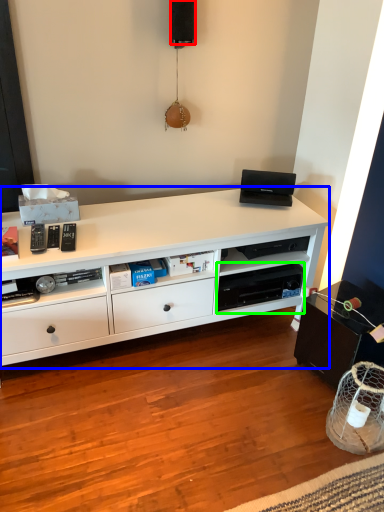
Question: Which object is positioned farthest from speaker (highlighted by a red box)? Select from desk (highlighted by a blue box) and shelf (highlighted by a green box).

Choices:
 (A) desk
 (B) shelf

Answer: (B)